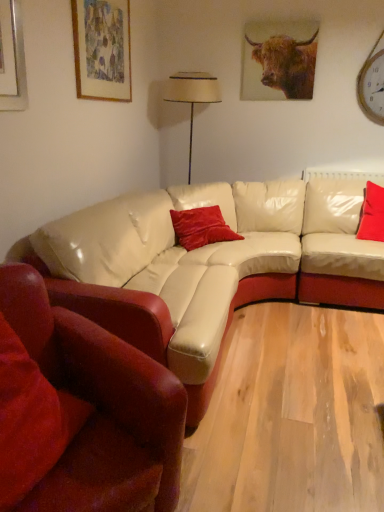
Question: Choose the correct answer: Is velvet red pillow at right, arranged as the first pillow when viewed from the right, inside brown textured bull at upper center or outside it?

Choices:
 (A) outside
 (B) inside

Answer: (A)

Question: Is velvet red pillow at right, arranged as the first pillow when viewed from the right, in front of or behind brown textured bull at upper center in the image?

Choices:
 (A) front
 (B) behind

Answer: (A)

Question: Estimate the real-world distances between objects in this image. Which object is closer to the wooden clock at upper right?

Choices:
 (A) matte paper picture frame at upper left
 (B) brown textured bull at upper center
 (C) velvet red pillow at center, the second pillow in the back-to-front sequence
 (D) velvet red pillow at right, arranged as the first pillow when viewed from the right
 (E) velvet red pillow at lower left, which is counted as the third pillow, starting from the right

Answer: (B)

Question: Which object is positioned farthest from the brown textured bull at upper center?

Choices:
 (A) matte paper picture frame at upper left
 (B) suede-like beige couch at lower left
 (C) velvet red pillow at lower left, positioned as the 3th pillow in back-to-front order
 (D) wooden clock at upper right
 (E) beige fabric lampshade at center

Answer: (C)